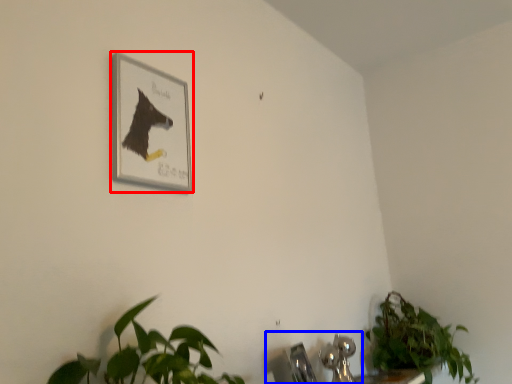
Question: Among these objects, which one is farthest to the camera, picture frame (highlighted by a red box) or sink (highlighted by a blue box)?

Choices:
 (A) picture frame
 (B) sink

Answer: (B)